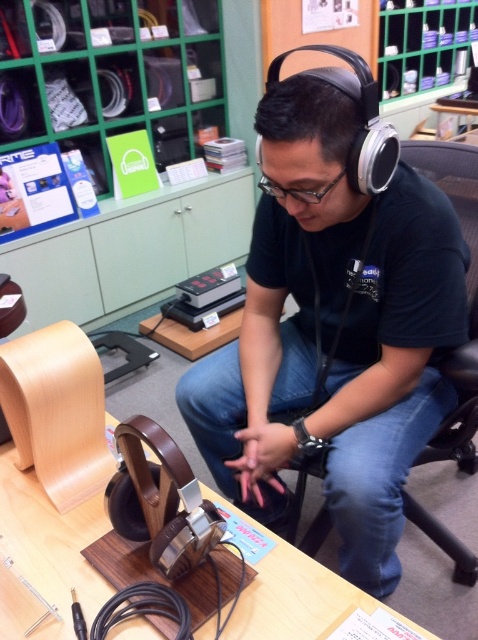
What are the coordinates of the matte black headphones at center?

The coordinates of the matte black headphones at center are at point (334, 332).

Consider the image. You are a customer in an electronics store. You see the matte black headphones at center and the brown wood table at center. Which object is directly above the other?

The matte black headphones at center is positioned over brown wood table at center, so the matte black headphones at center are directly above the brown wood table at center.